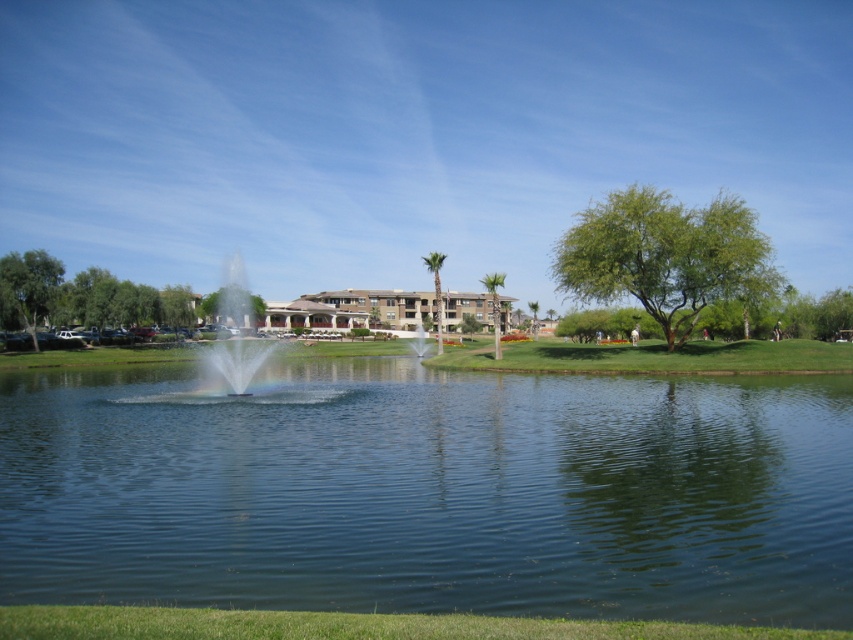
You are designing a layout for a new park and want to place a bench. You have two options for placement based on the image. The first option is near the clear blue water at center, and the second is near the clear glass fountain at center. Which location would allow the bench to be placed closer to the edge of the water without overlapping either object?

The clear blue water at center is thinner than the clear glass fountain at center, so placing the bench near the clear blue water at center would allow it to be closer to the edge without overlapping either object.

You are standing at the center of the image and want to walk towards the green grass at lower center. Which direction should you move in to reach it?

To reach the green grass at lower center, you should move towards the lower center direction, as it is located at point coordinates of 0.978 on the x and 0.410 on the y axis.